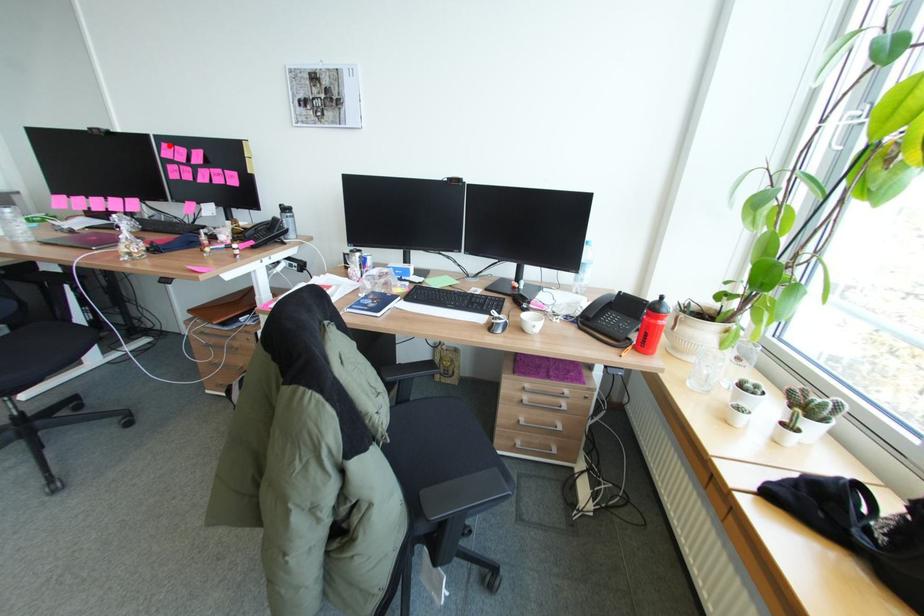
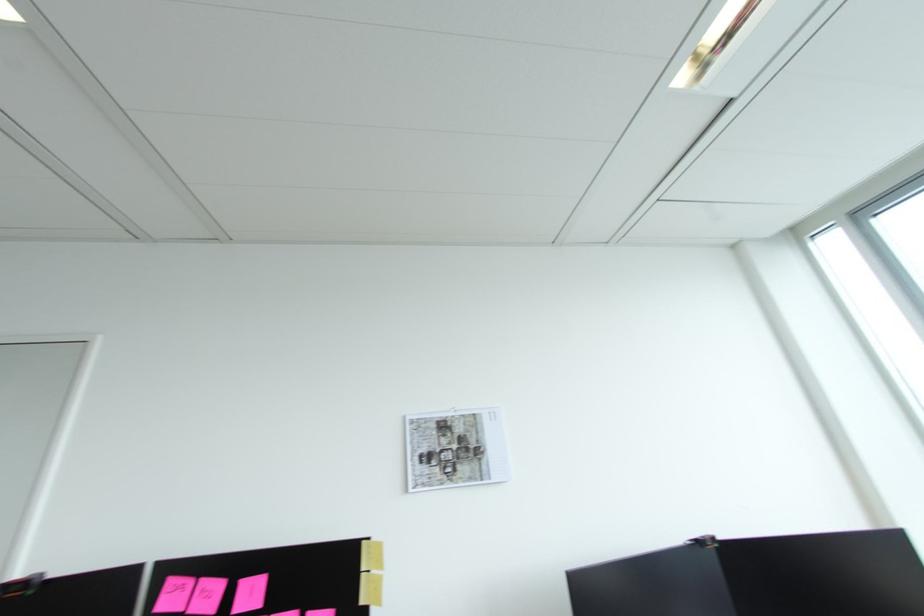
Find the pixel in the second image that matches the highlighted location in the first image.

(176, 582)